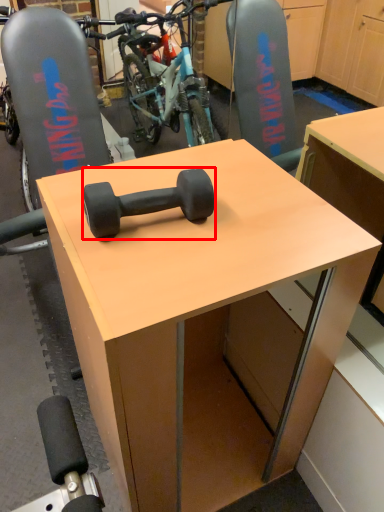
Question: From the image's perspective, where is dumbbell (annotated by the red box) located relative to desk?

Choices:
 (A) above
 (B) below

Answer: (A)